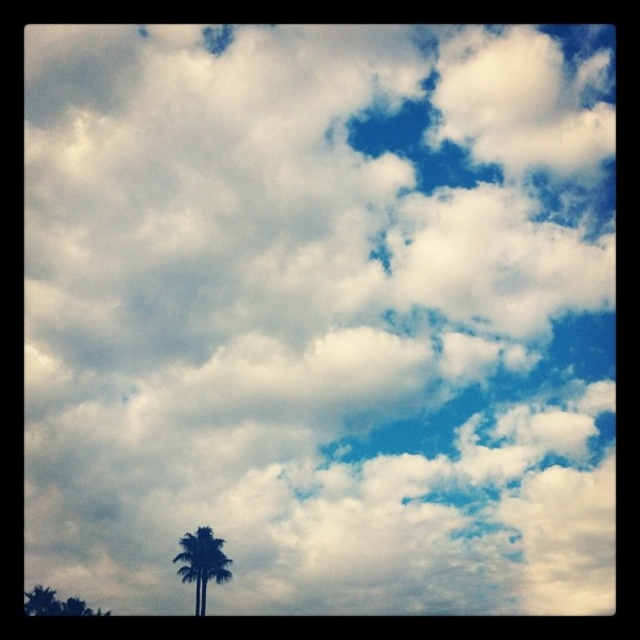
Consider the image. Is green leafy palm tree at lower center taller than green leafy tree at lower left?

Correct, green leafy palm tree at lower center is much taller as green leafy tree at lower left.

Locate an element on the screen. This screenshot has height=640, width=640. green leafy palm tree at lower center is located at coordinates (202, 563).

Is point (205, 579) positioned in front of point (84, 605)?

Yes, point (205, 579) is in front of point (84, 605).

Where is `green leafy palm tree at lower center`? green leafy palm tree at lower center is located at coordinates (202, 563).